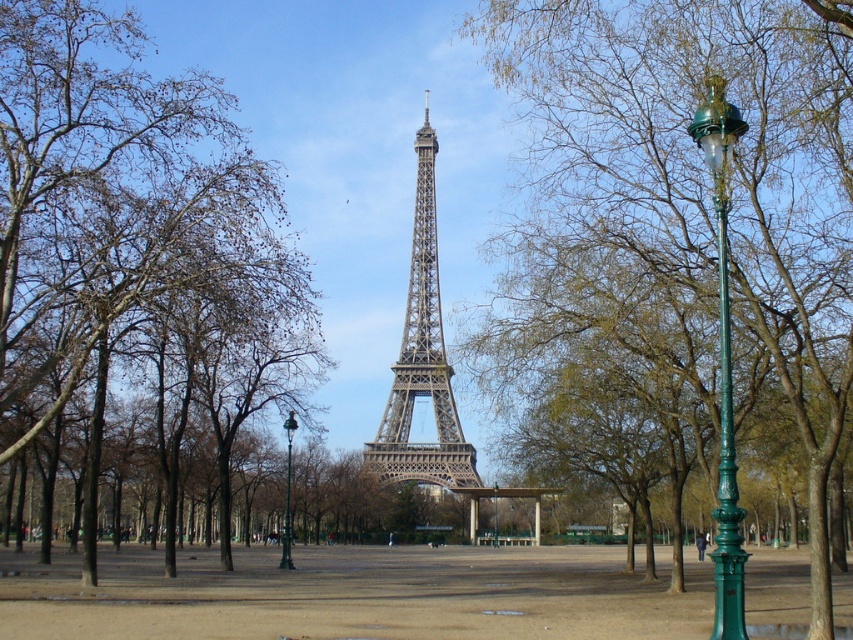
Does green leafy tree at center have a greater height compared to green metal streetlight at center?

Yes, green leafy tree at center is taller than green metal streetlight at center.

The image size is (853, 640). What are the coordinates of `green leafy tree at center` in the screenshot? It's located at (706, 173).

Which is behind, point (300, 296) or point (718, 529)?

Point (300, 296)

Where is `brown leafy tree at left`? Image resolution: width=853 pixels, height=640 pixels. brown leafy tree at left is located at coordinates (115, 204).

How far apart are green leafy tree at center and green polished metal streetlight at right?

green leafy tree at center and green polished metal streetlight at right are 54.15 feet apart from each other.

Can you confirm if green leafy tree at center is shorter than green polished metal streetlight at right?

No.

Is point (839, 310) positioned behind point (738, 536)?

Yes, point (839, 310) is farther from viewer.

Locate an element on the screen. This screenshot has height=640, width=853. green leafy tree at center is located at coordinates (706, 173).